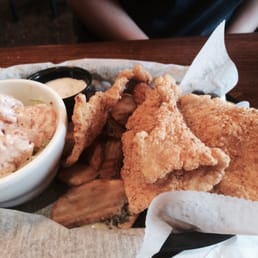
The image size is (258, 258). Identify the location of wooden table top. (130, 52).